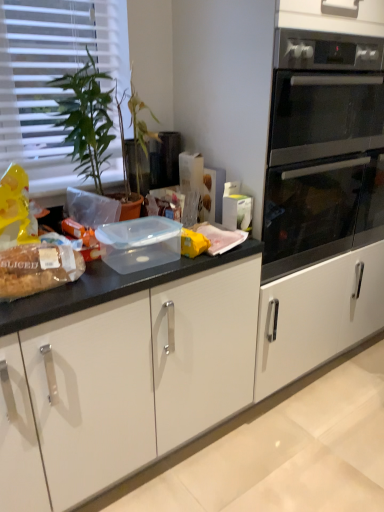
Question: From the image's perspective, relative to white plastic blinds at upper left, is green glossy plant at left above or below?

Choices:
 (A) above
 (B) below

Answer: (B)

Question: From a real-world perspective, is green glossy plant at left above or below white plastic blinds at upper left?

Choices:
 (A) below
 (B) above

Answer: (A)

Question: Estimate the real-world distances between objects in this image. Which object is farther from the white plastic blinds at upper left?

Choices:
 (A) green glossy plant at left
 (B) stainless steel oven at right
 (C) translucent plastic bread at left

Answer: (B)

Question: Based on their relative distances, which object is nearer to the translucent plastic bread at left?

Choices:
 (A) white plastic blinds at upper left
 (B) stainless steel oven at right
 (C) green glossy plant at left

Answer: (C)